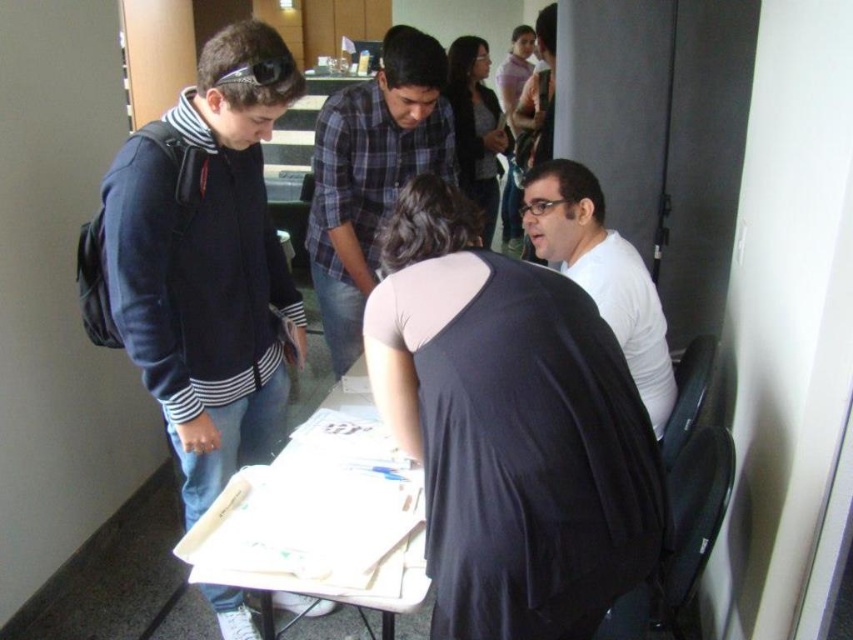
Can you confirm if matte black jacket at left is shorter than white matte shirt at right?

No, matte black jacket at left is not shorter than white matte shirt at right.

Consider the image. Is matte black jacket at left to the right of white matte shirt at right from the viewer's perspective?

Incorrect, matte black jacket at left is not on the right side of white matte shirt at right.

What do you see at coordinates (206, 268) in the screenshot? The image size is (853, 640). I see `matte black jacket at left` at bounding box center [206, 268].

Image resolution: width=853 pixels, height=640 pixels. Identify the location of matte black jacket at left. (206, 268).

Where is `white matte shirt at right`? The image size is (853, 640). white matte shirt at right is located at coordinates (602, 275).

Which of these two, white matte shirt at right or matte black shirt at center, stands shorter?

With less height is white matte shirt at right.

Who is more forward, (x=625, y=280) or (x=485, y=147)?

Point (x=625, y=280) is in front.

Where is `white matte shirt at right`? The width and height of the screenshot is (853, 640). white matte shirt at right is located at coordinates (602, 275).

Does point (579, 568) lie in front of point (463, 152)?

That is True.

Does black matte shirt at center have a greater width compared to matte black shirt at center?

Yes.

At what (x,y) coordinates should I click in order to perform the action: click on black matte shirt at center. Please return your answer as a coordinate pair (x, y). Looking at the image, I should click on (509, 428).